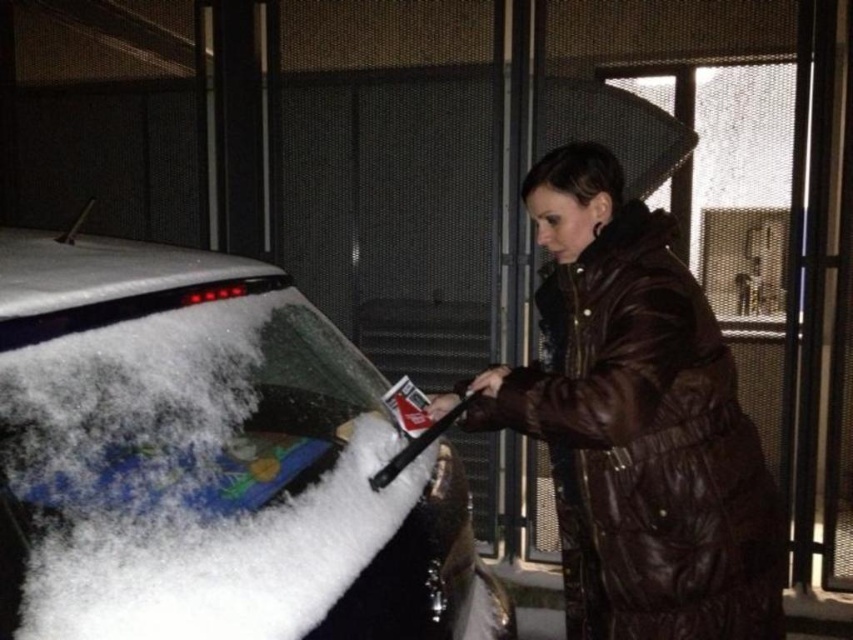
Question: Is snow-covered glass at left wider than brown leather jacket at center?

Choices:
 (A) yes
 (B) no

Answer: (A)

Question: Which point appears closest to the camera in this image?

Choices:
 (A) (192, 628)
 (B) (555, 445)

Answer: (A)

Question: Observing the image, what is the correct spatial positioning of snow-covered glass at left in reference to brown leather jacket at center?

Choices:
 (A) right
 (B) left

Answer: (B)

Question: In this image, where is snow-covered glass at left located relative to brown leather jacket at center?

Choices:
 (A) above
 (B) below

Answer: (B)